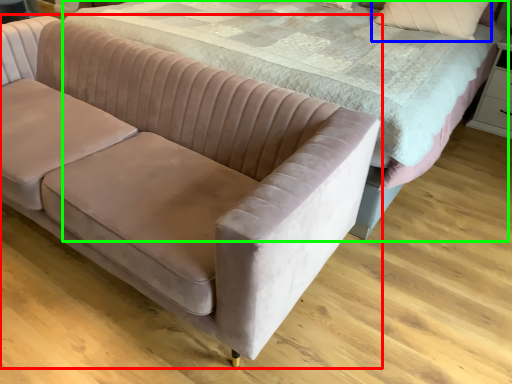
Question: Which object is the closest to the studio couch (highlighted by a red box)? Choose among these: pillow (highlighted by a blue box) or bed (highlighted by a green box).

Choices:
 (A) pillow
 (B) bed

Answer: (B)